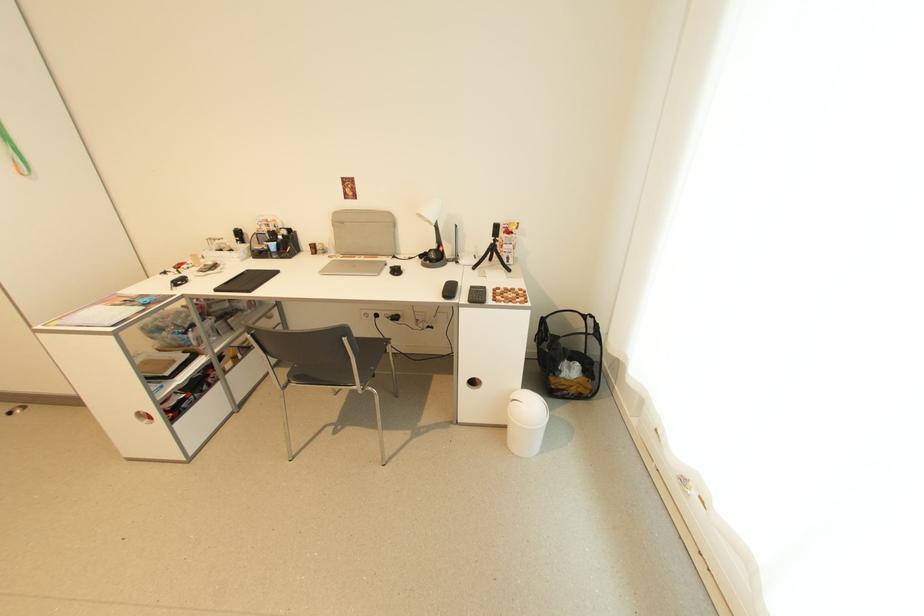
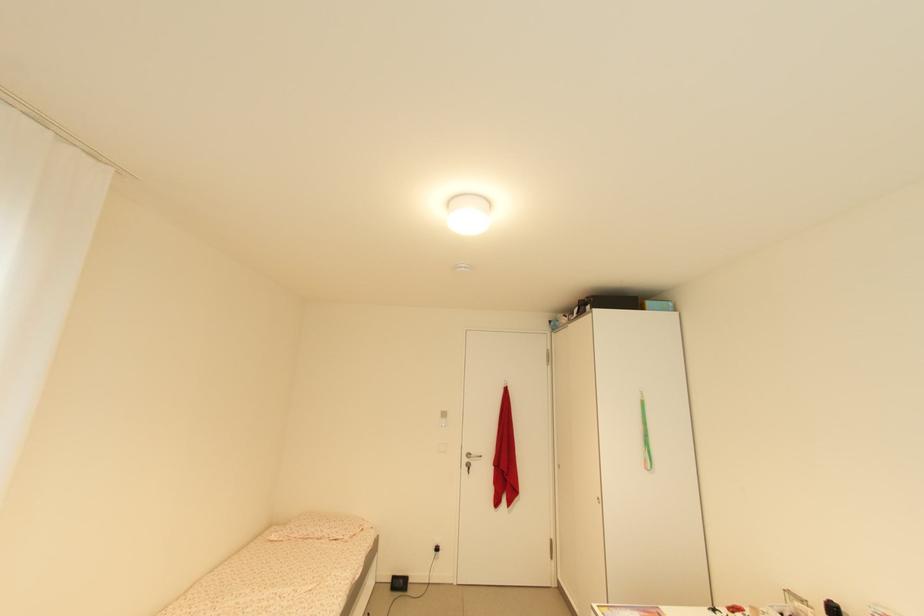
Question: Based on the continuous images, in which direction is the camera rotating? Reply with the corresponding letter.

Choices:
 (A) Left
 (B) Right
 (C) Up
 (D) Down

Answer: (A)